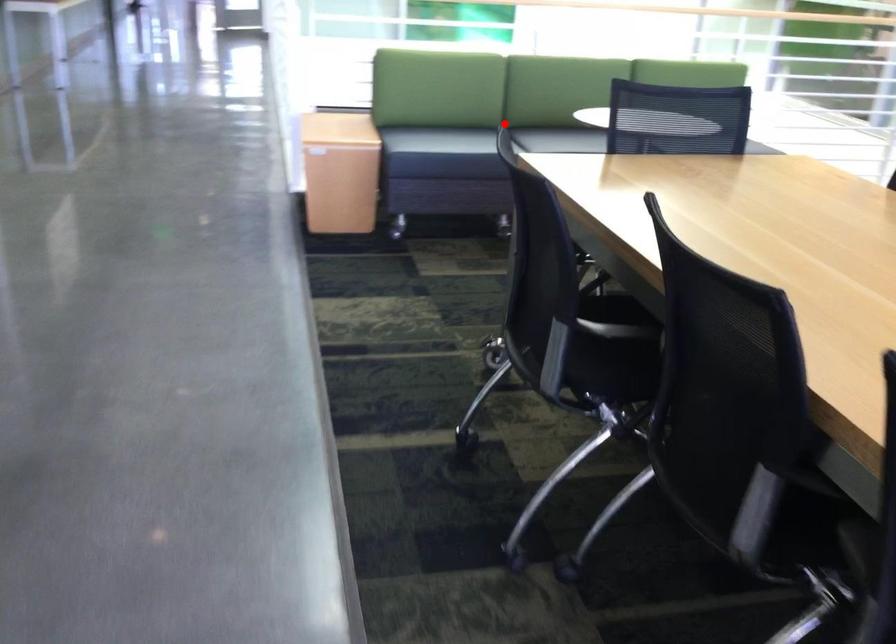
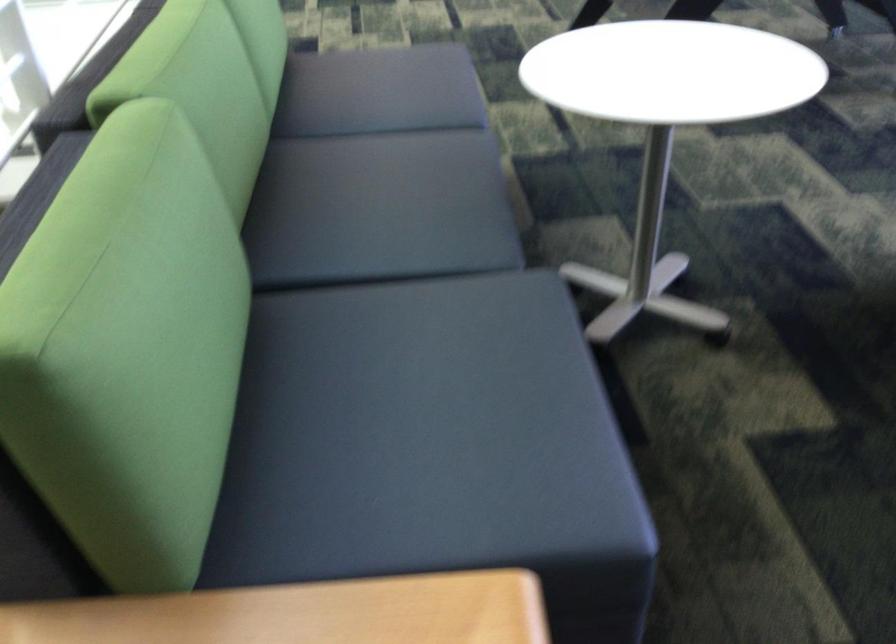
Question: I am providing you with two images of the same scene from different viewpoints. Given a red point in image1, look at the same physical point in image2. Is it:

Choices:
 (A) Closer to the viewpoint
 (B) Farther from the viewpoint

Answer: (A)